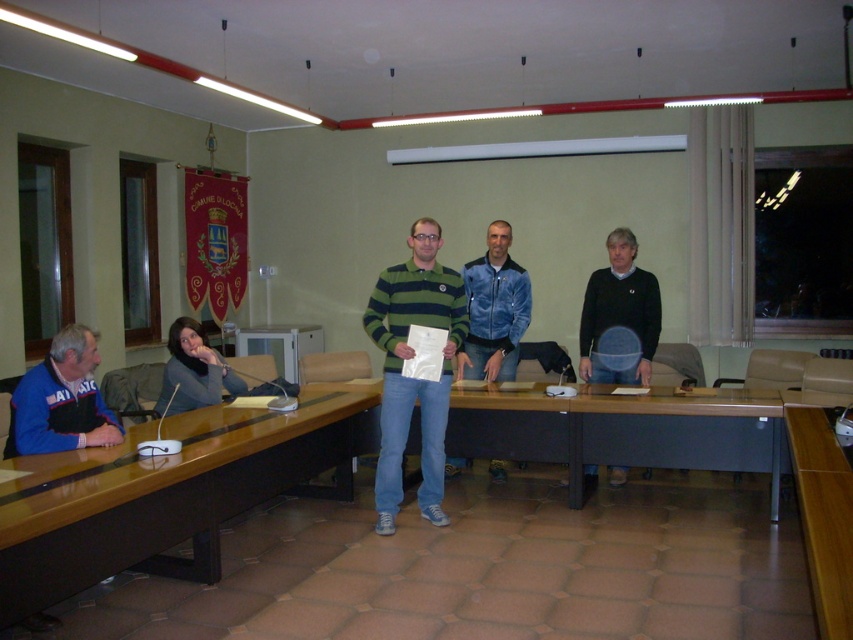
You are standing at the entrance of the room and see the green striped polo shirt at center and the brown wooden table at lower right. Which object is closer to the entrance?

The green striped polo shirt at center is closer to the entrance because it is positioned to the left of the brown wooden table at lower right, which is further away from the entrance.

You are standing in the room and want to hand a document to both the person wearing the blue velour jacket at center and the person in the matte gray sweater at lower left. Which individual will you approach first to ensure you can reach them without moving past the other?

You should approach the blue velour jacket at center first because it is closer to you than the matte gray sweater at lower left, which is further away.

In the scene shown: You are organizing a meeting in this room and need to place a large document on the black matte table at center. Considering the size of the blue fleece jacket at left, will the document fit on the table?

The black matte table at center is larger in size than the blue fleece jacket at left, so the document should fit comfortably on the table as it is bigger than the jacket.